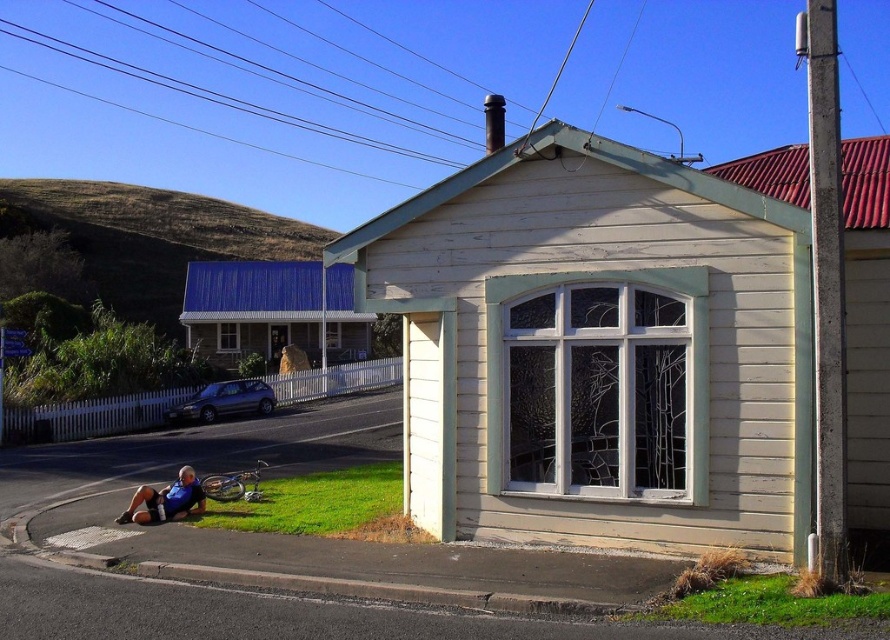
Question: Can you confirm if green grass at lower left is positioned to the left of blue fabric shirt at lower left?

Choices:
 (A) no
 (B) yes

Answer: (A)

Question: Among these objects, which one is farthest from the camera?

Choices:
 (A) green grass at lower left
 (B) blue fabric shirt at lower left

Answer: (B)

Question: Which is nearer to the blue fabric shirt at lower left?

Choices:
 (A) green grass at lower right
 (B) green grass at lower left

Answer: (B)

Question: Which point is closer to the camera taking this photo?

Choices:
 (A) (344, 496)
 (B) (152, 504)
 (C) (765, 592)

Answer: (C)

Question: Is green grass at lower right positioned at the back of blue fabric shirt at lower left?

Choices:
 (A) yes
 (B) no

Answer: (B)

Question: Can you confirm if green grass at lower right is positioned to the right of blue fabric shirt at lower left?

Choices:
 (A) no
 (B) yes

Answer: (B)